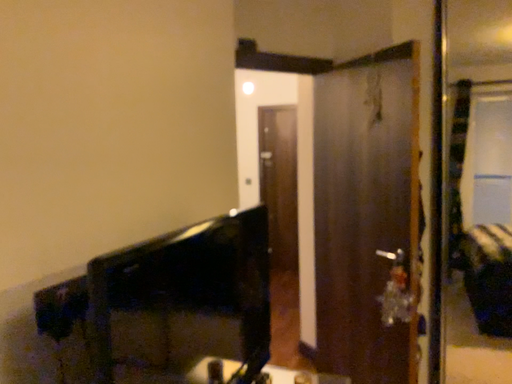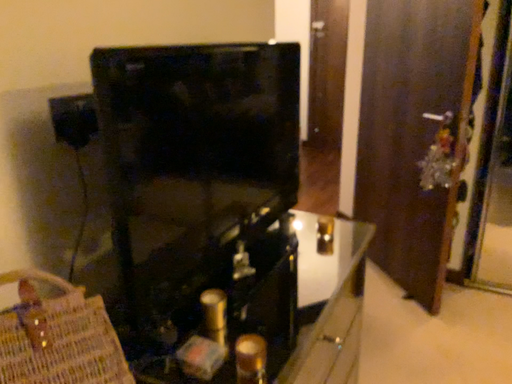
Question: Which way did the camera rotate in the video?

Choices:
 (A) rotated upward
 (B) rotated downward

Answer: (B)